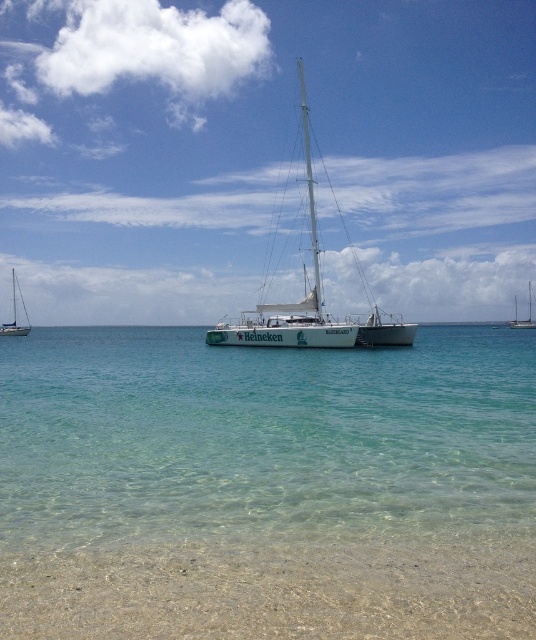
Who is lower down, clear water at center or white glossy sailboat at left?

clear water at center

Between clear water at center and white glossy sailboat at left, which one is positioned higher?

Positioned higher is white glossy sailboat at left.

At what (x,y) coordinates should I click in order to perform the action: click on clear water at center. Please return your answer as a coordinate pair (x, y). The height and width of the screenshot is (640, 536). Looking at the image, I should click on pyautogui.click(x=263, y=436).

Is point (502, 394) positioned after point (398, 561)?

Yes, it is behind point (398, 561).

Between clear water at center and clear sand at lower center, which one is positioned higher?

clear water at center

Is point (480, 528) positioned behind point (495, 556)?

That is True.

Image resolution: width=536 pixels, height=640 pixels. I want to click on clear water at center, so click(263, 436).

Measure the distance between point (465, 432) and camera.

Point (465, 432) is 14.16 meters from camera.

Which is more to the right, clear water at center or white glossy mast at center?

From the viewer's perspective, white glossy mast at center appears more on the right side.

Where is `clear water at center`? This screenshot has height=640, width=536. clear water at center is located at coordinates 263,436.

This screenshot has width=536, height=640. What are the coordinates of `clear water at center` in the screenshot? It's located at pos(263,436).